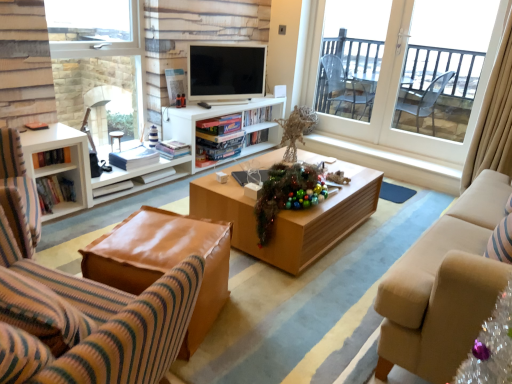
Find the location of a particular element. free location to the right of leather ottoman at lower left is located at coordinates (265, 325).